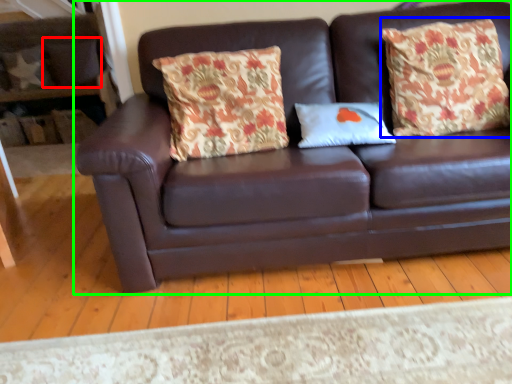
Question: Estimate the real-world distances between objects in this image. Which object is farther from pillow (highlighted by a red box), throw pillow (highlighted by a blue box) or studio couch (highlighted by a green box)?

Choices:
 (A) throw pillow
 (B) studio couch

Answer: (A)